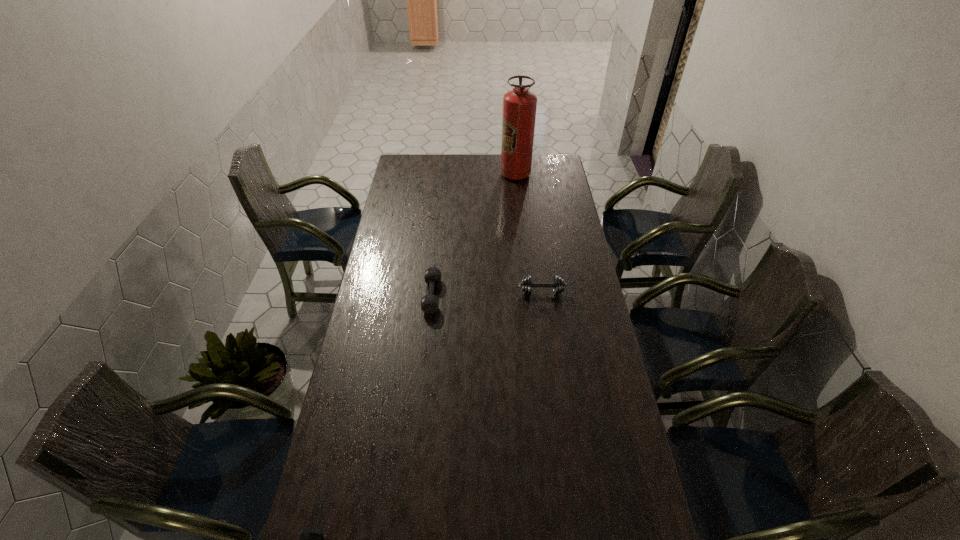
Identify the location of blank area in the image that satisfies the following two spatial constraints: 1. on the label side of the tallest object; 2. on the left side of the tallest dumbbell. This screenshot has height=540, width=960. (528, 292).

Find the location of a particular element. The image size is (960, 540). vacant position in the image that satisfies the following two spatial constraints: 1. on the label side of the tallest object; 2. on the left side of the third shortest object is located at coordinates (528, 292).

I want to click on free location that satisfies the following two spatial constraints: 1. on the label side of the fire extinguisher; 2. on the front side of the third object from right to left, so click(x=528, y=295).

Where is `vacant space that satisfies the following two spatial constraints: 1. on the label side of the tallest object; 2. on the left side of the tallest dumbbell`? The height and width of the screenshot is (540, 960). vacant space that satisfies the following two spatial constraints: 1. on the label side of the tallest object; 2. on the left side of the tallest dumbbell is located at coordinates (528, 292).

Locate an element on the screen. Image resolution: width=960 pixels, height=540 pixels. vacant space that satisfies the following two spatial constraints: 1. on the label side of the tallest object; 2. on the front side of the second dumbbell from left to right is located at coordinates coord(528,295).